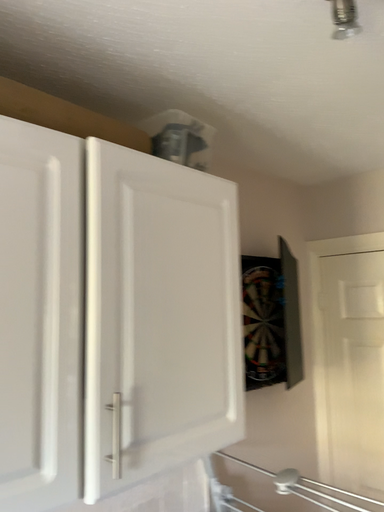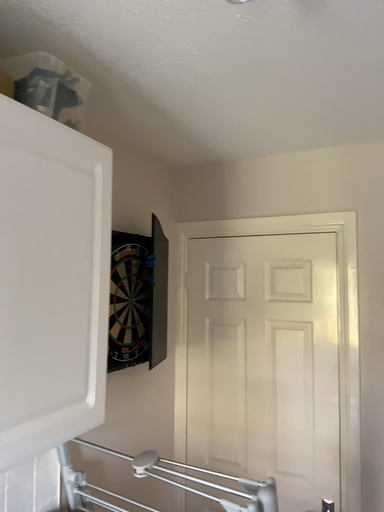
Question: How did the camera likely rotate when shooting the video?

Choices:
 (A) rotated right
 (B) rotated left

Answer: (A)